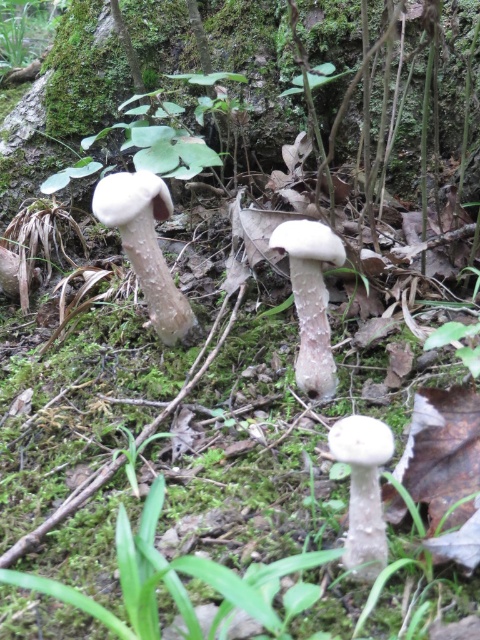
You are a small forest creature trying to jump from the white matte mushroom at left to the white matte mushroom at center. Can you make the jump if your maximum jump distance is 20 inches?

The distance between the white matte mushroom at left and the white matte mushroom at center is 19.78 inches, so yes, the creature can make the jump since it is within its maximum jump distance of 20 inches.

You are a mycologist examining the forest floor. You notice the white matte mushroom at left and the white fuzzy mushroom at center. Which one has a greater height?

The white matte mushroom at left is taller than the white fuzzy mushroom at center.